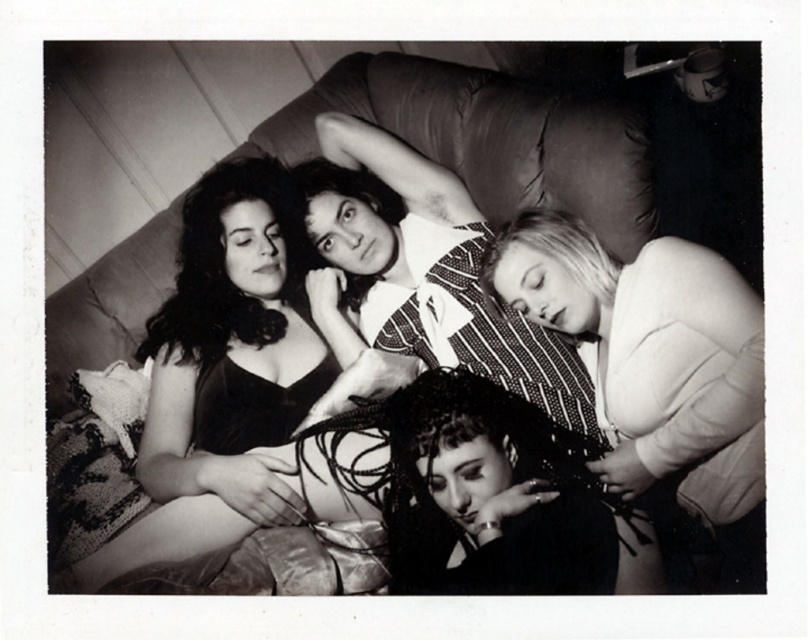
Question: Which point appears closest to the camera in this image?

Choices:
 (A) (505, 195)
 (B) (242, 282)

Answer: (B)

Question: Considering the relative positions of leather couch at center and striped fabric shirt at center in the image provided, where is leather couch at center located with respect to striped fabric shirt at center?

Choices:
 (A) above
 (B) below

Answer: (A)

Question: Does matte black dress at upper left appear over leather couch at center?

Choices:
 (A) no
 (B) yes

Answer: (A)

Question: Which object is closer to the camera taking this photo?

Choices:
 (A) matte black dress at upper left
 (B) striped fabric shirt at center

Answer: (A)

Question: Among these objects, which one is farthest from the camera?

Choices:
 (A) matte black dress at upper left
 (B) leather couch at center
 (C) white fluffy coat at lower right

Answer: (B)

Question: Can you confirm if white fluffy coat at lower right is wider than striped fabric shirt at center?

Choices:
 (A) no
 (B) yes

Answer: (A)